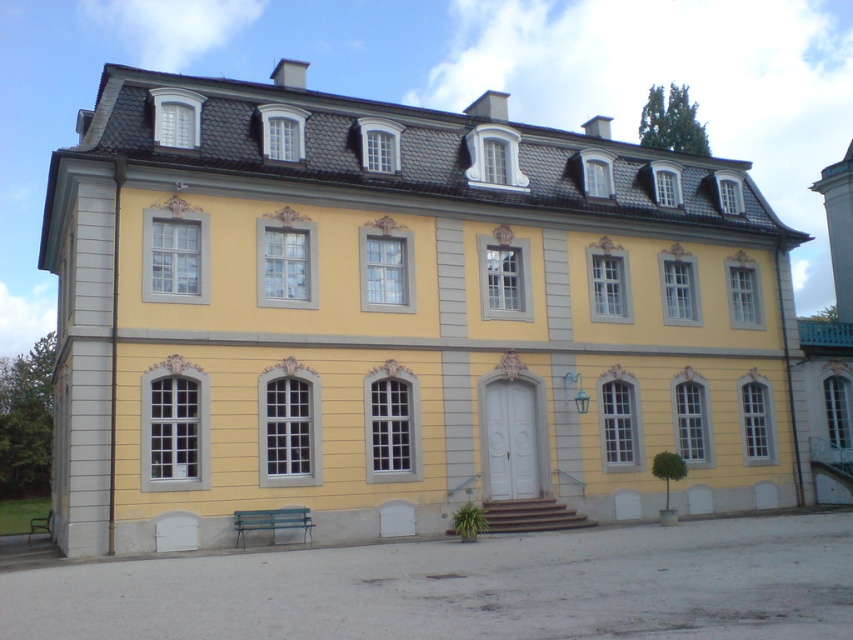
Is green painted wood bench at lower left thinner than green wooden bench at lower left?

Correct, green painted wood bench at lower left's width is less than green wooden bench at lower left's.

You are a GUI agent. You are given a task and a screenshot of the screen. Output one action in this format:
    pyautogui.click(x=<x>, y=<y>)
    Task: Click on the green painted wood bench at lower left
    
    Given the screenshot: What is the action you would take?
    pyautogui.click(x=271, y=522)